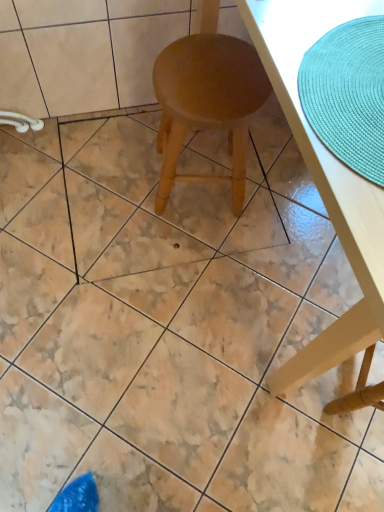
Identify the location of blank area to the left of light brown wood stool at center. (110, 177).